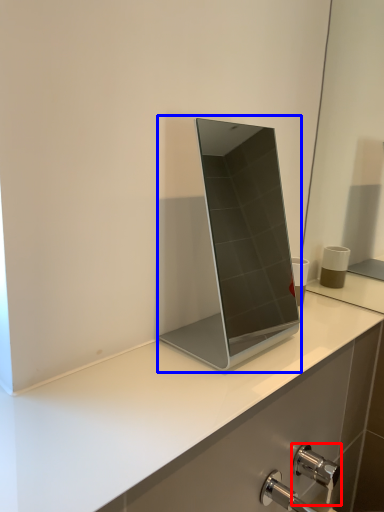
Question: Which of the following is the farthest to the observer, tap (highlighted by a red box) or laptop (highlighted by a blue box)?

Choices:
 (A) tap
 (B) laptop

Answer: (A)